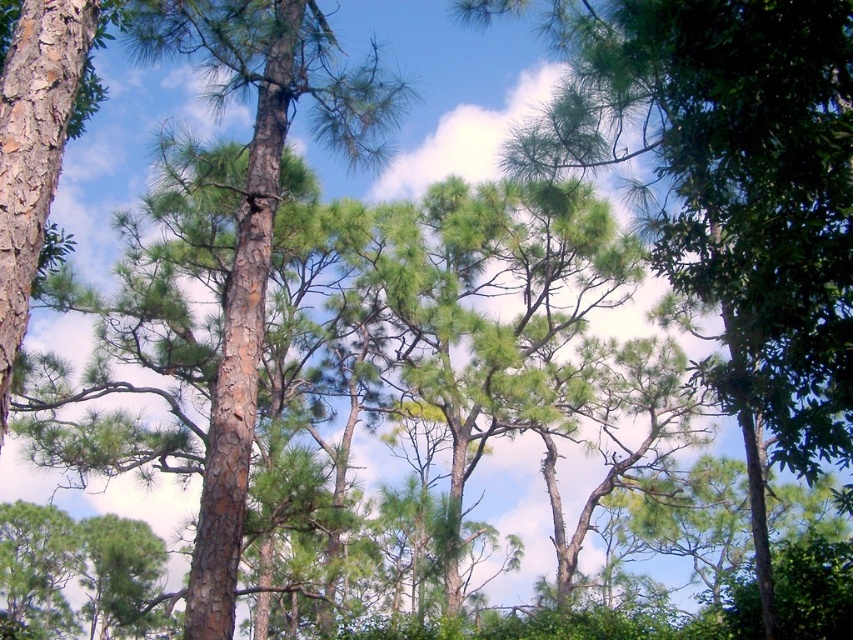
Is point (785, 195) behind point (222, 403)?

No, (785, 195) is closer to viewer.

Can you confirm if green matte tree at center is bigger than brown rough bark tree at left?

No.

Who is more forward, [699,292] or [198,22]?

Positioned in front is point [699,292].

Locate an element on the screen. The width and height of the screenshot is (853, 640). green matte tree at center is located at coordinates (733, 182).